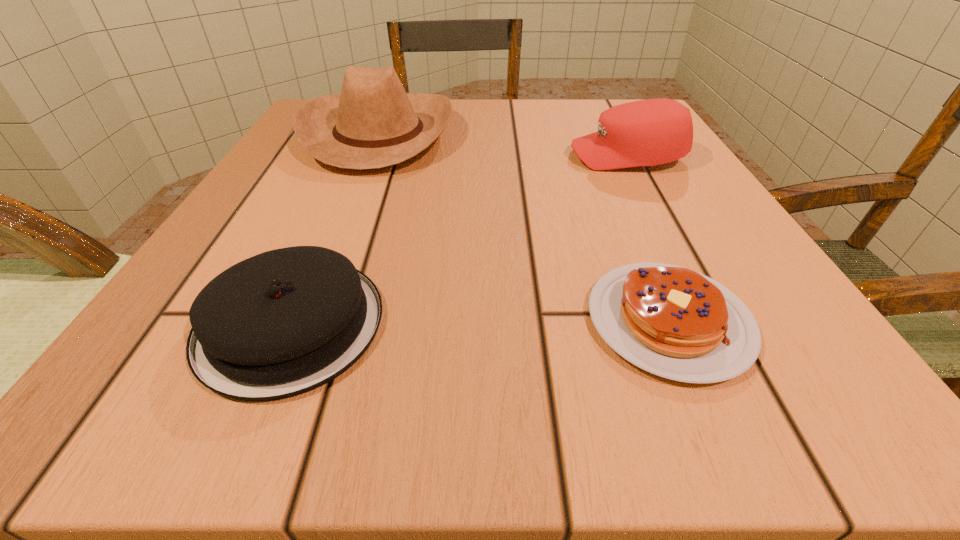
What are the coordinates of `object present at the far right corner` in the screenshot? It's located at point(650,132).

Where is `object present at the near right corner`? This screenshot has height=540, width=960. object present at the near right corner is located at coordinates (671, 321).

In the image, there is a desktop. At what (x,y) coordinates should I click in order to perform the action: click on vacant region at the far edge. Please return your answer as a coordinate pair (x, y). This screenshot has width=960, height=540. Looking at the image, I should click on (487, 110).

This screenshot has height=540, width=960. I want to click on vacant space at the near edge of the desktop, so click(x=564, y=377).

Identify the location of vacant space at the left edge of the desktop. The height and width of the screenshot is (540, 960). (289, 153).

At what (x,y) coordinates should I click in order to perform the action: click on free space at the near left corner. Please return your answer as a coordinate pair (x, y). Looking at the image, I should click on (87, 416).

In the image, there is a desktop. Where is `vacant space at the near right corner`? The image size is (960, 540). vacant space at the near right corner is located at coordinates (831, 412).

Locate an element on the screen. vacant point located between the second tallest object and the taller pancake is located at coordinates (459, 240).

This screenshot has width=960, height=540. Find the location of `unoccupied position between the second tallest object and the left pancake`. unoccupied position between the second tallest object and the left pancake is located at coordinates (459, 240).

You are a GUI agent. You are given a task and a screenshot of the screen. Output one action in this format:
    pyautogui.click(x=<x>, y=<y>)
    Task: Click on the free space between the tallest object and the left pancake
    The image size is (960, 540).
    Given the screenshot: What is the action you would take?
    pyautogui.click(x=335, y=229)